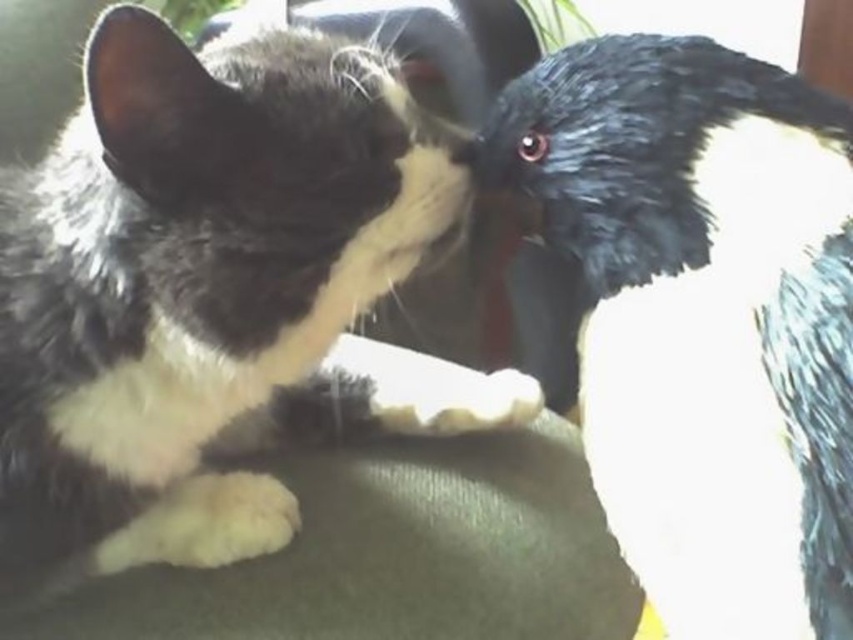
Question: Does black and white fur cat at center have a lesser width compared to black fuzzy nose at center?

Choices:
 (A) no
 (B) yes

Answer: (A)

Question: Does black and white fur cat at center appear on the right side of black fuzzy nose at center?

Choices:
 (A) no
 (B) yes

Answer: (A)

Question: Is black and white fur cat at center wider than black fuzzy nose at center?

Choices:
 (A) yes
 (B) no

Answer: (A)

Question: Which object appears closest to the camera in this image?

Choices:
 (A) black and white fur cat at center
 (B) black fuzzy nose at center

Answer: (A)